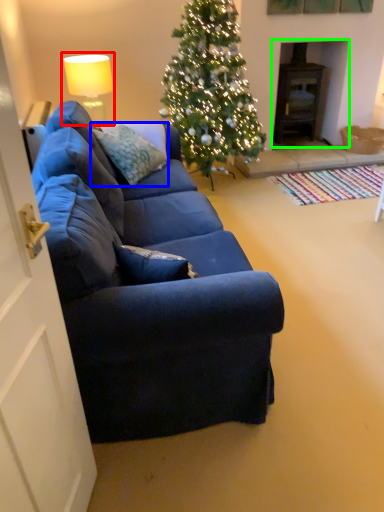
Question: Which object is the farthest from lamp (highlighted by a red box)? Choose among these: pillow (highlighted by a blue box) or fireplace (highlighted by a green box).

Choices:
 (A) pillow
 (B) fireplace

Answer: (B)